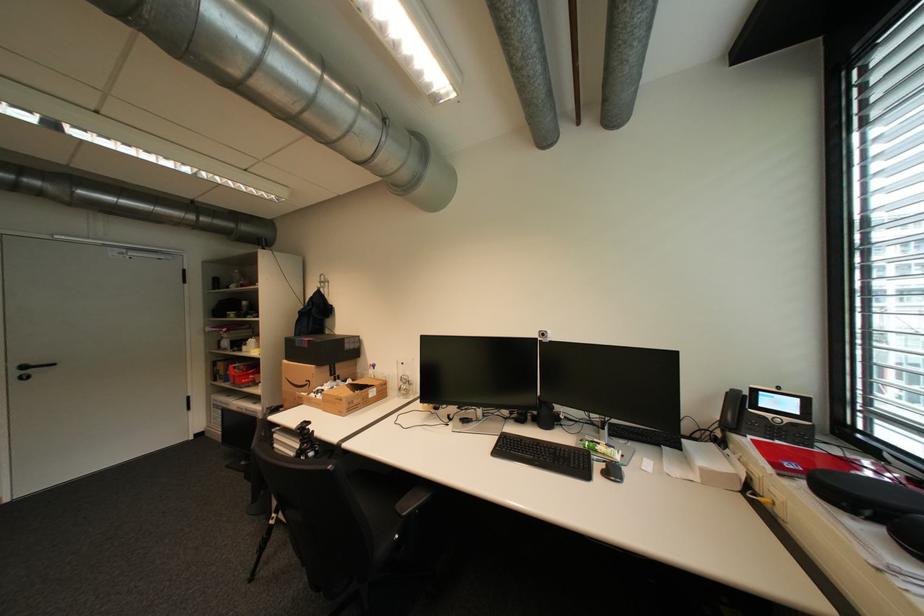
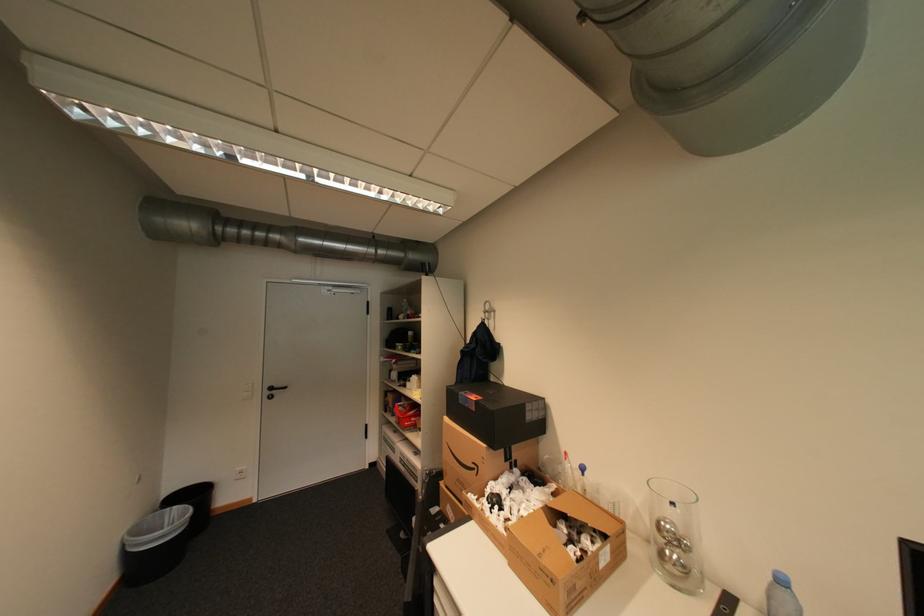
Find the pixel in the second image that matches (x=317, y=383) in the first image.

(484, 468)